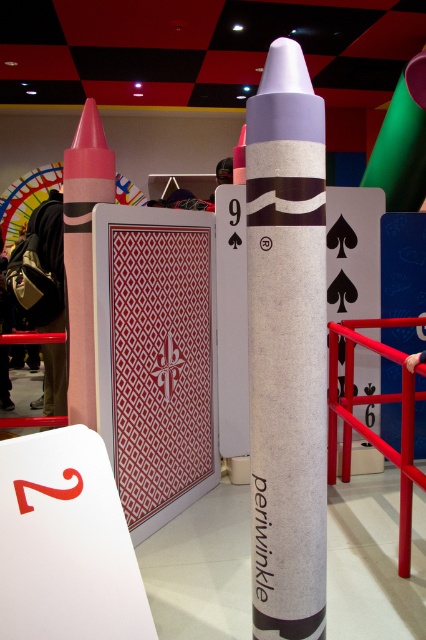
Question: Which point appears farthest from the camera in this image?

Choices:
 (A) (86, 188)
 (B) (256, 168)

Answer: (A)

Question: Among these objects, which one is nearest to the camera?

Choices:
 (A) matte paper crayon at center
 (B) matte pink crayon at left

Answer: (A)

Question: Does matte paper crayon at center lie behind matte pink crayon at left?

Choices:
 (A) yes
 (B) no

Answer: (B)

Question: Does matte paper crayon at center have a greater width compared to matte pink crayon at left?

Choices:
 (A) yes
 (B) no

Answer: (B)

Question: Is matte paper crayon at center to the right of matte pink crayon at left from the viewer's perspective?

Choices:
 (A) no
 (B) yes

Answer: (B)

Question: Among these points, which one is farthest from the camera?

Choices:
 (A) (255, 228)
 (B) (86, 180)

Answer: (B)